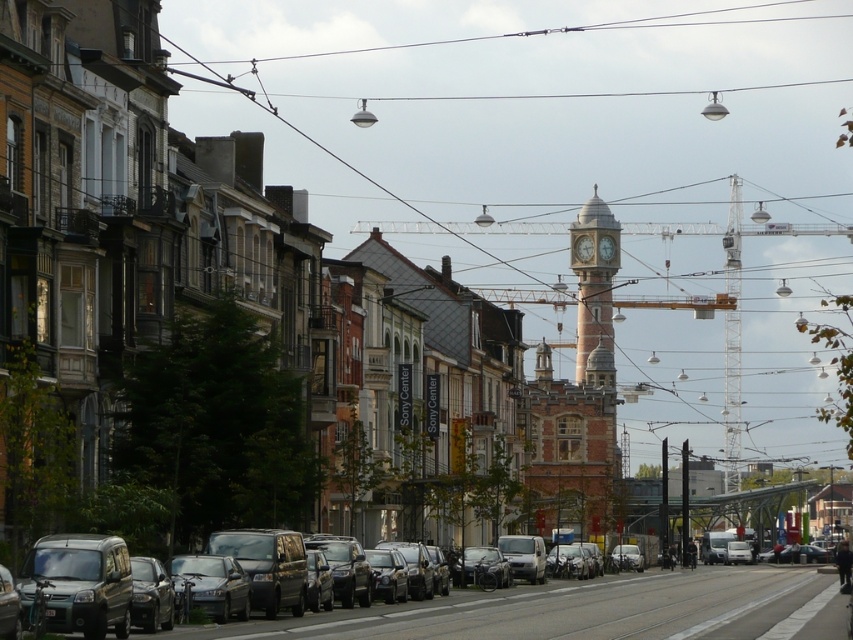
Question: Which point is closer to the camera?

Choices:
 (A) (601, 248)
 (B) (587, 253)
 (C) (53, 604)
 (D) (239, 627)

Answer: (C)

Question: Which object appears closest to the camera in this image?

Choices:
 (A) metallic construction crane at center
 (B) black wire at upper center
 (C) gold metallic clock at center
 (D) matte black van at lower left

Answer: (D)

Question: Does metallic construction crane at center have a greater width compared to black wire at upper center?

Choices:
 (A) no
 (B) yes

Answer: (A)

Question: Is black wire at upper center further to the viewer compared to brass textured clock tower at center?

Choices:
 (A) yes
 (B) no

Answer: (A)

Question: Which point appears farthest from the camera in this image?

Choices:
 (A) (593, 253)
 (B) (784, 294)
 (C) (801, 572)
 (D) (581, 273)

Answer: (B)

Question: Is the position of matte black van at lower left less distant than that of brick clock tower at center?

Choices:
 (A) yes
 (B) no

Answer: (A)